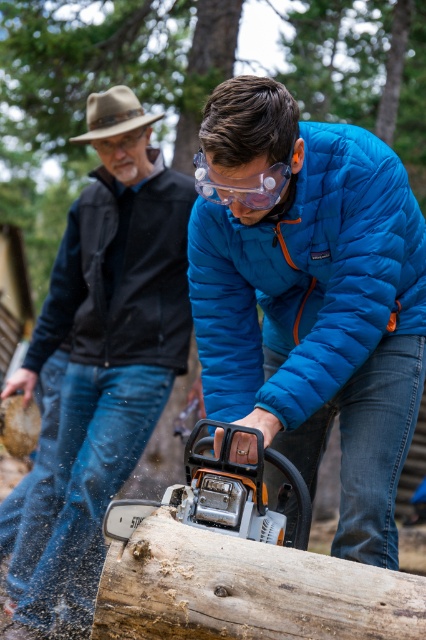
How much distance is there between blue quilted jacket at center and black softshell jacket at upper left?

blue quilted jacket at center is 4.23 feet away from black softshell jacket at upper left.

Is point (405, 198) closer to viewer compared to point (160, 292)?

Yes, it is in front of point (160, 292).

At what (x,y) coordinates should I click in order to perform the action: click on blue quilted jacket at center. Please return your answer as a coordinate pair (x, y). Looking at the image, I should click on (307, 278).

Describe the element at coordinates (120, 278) in the screenshot. I see `black softshell jacket at upper left` at that location.

Who is more distant from viewer, (184, 200) or (226, 452)?

Positioned behind is point (184, 200).

Image resolution: width=426 pixels, height=640 pixels. I want to click on black softshell jacket at upper left, so click(120, 278).

Find the location of a particular element. black softshell jacket at upper left is located at coordinates (120, 278).

Is matte black jacket at left positioned behind black softshell jacket at upper left?

No, it is not.

Is point (97, 310) closer to camera compared to point (112, 196)?

That is True.

Locate an element on the screen. matte black jacket at left is located at coordinates (100, 356).

This screenshot has height=640, width=426. Find the location of `matte black jacket at left`. matte black jacket at left is located at coordinates (100, 356).